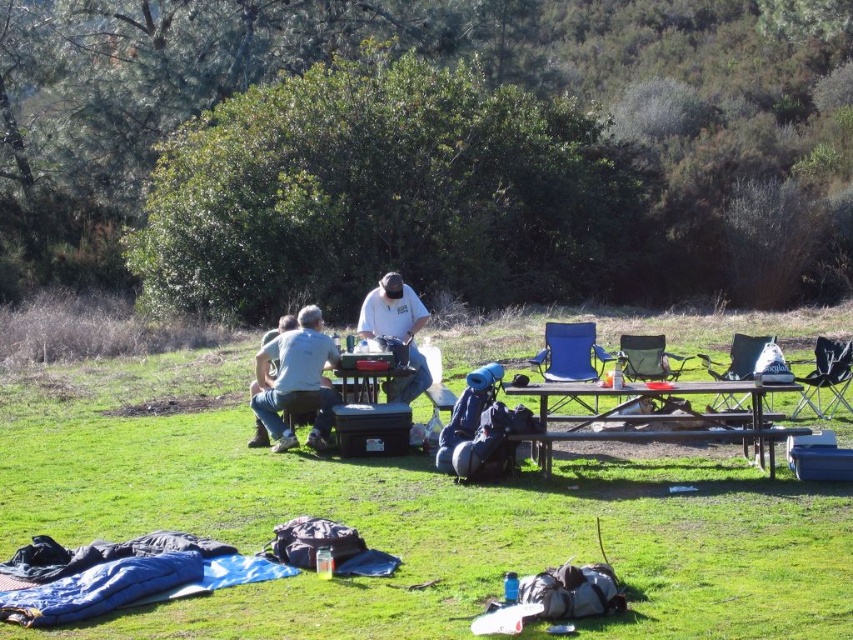
Question: Is blue fabric chair at center smaller than green fabric chair at center?

Choices:
 (A) yes
 (B) no

Answer: (B)

Question: Which is nearer to the brown wooden picnic table at center?

Choices:
 (A) white fabric shirt at center
 (B) green fabric chair at center
 (C) green fabric chair at right
 (D) metallic silver table at center

Answer: (C)

Question: Does gray cotton shirt at center appear on the right side of blue fabric chair at center?

Choices:
 (A) no
 (B) yes

Answer: (A)

Question: Among these points, which one is farthest from the camera?

Choices:
 (A) (757, 336)
 (B) (366, 387)
 (C) (821, 378)
 (D) (636, 362)

Answer: (A)

Question: Considering the relative positions of blue fabric chair at center and green fabric folding chair at center right in the image provided, where is blue fabric chair at center located with respect to green fabric folding chair at center right?

Choices:
 (A) below
 (B) above

Answer: (B)

Question: Which point is closer to the camera taking this photo?

Choices:
 (A) (561, 355)
 (B) (372, 385)
 (C) (840, 352)
 (D) (740, 348)

Answer: (B)